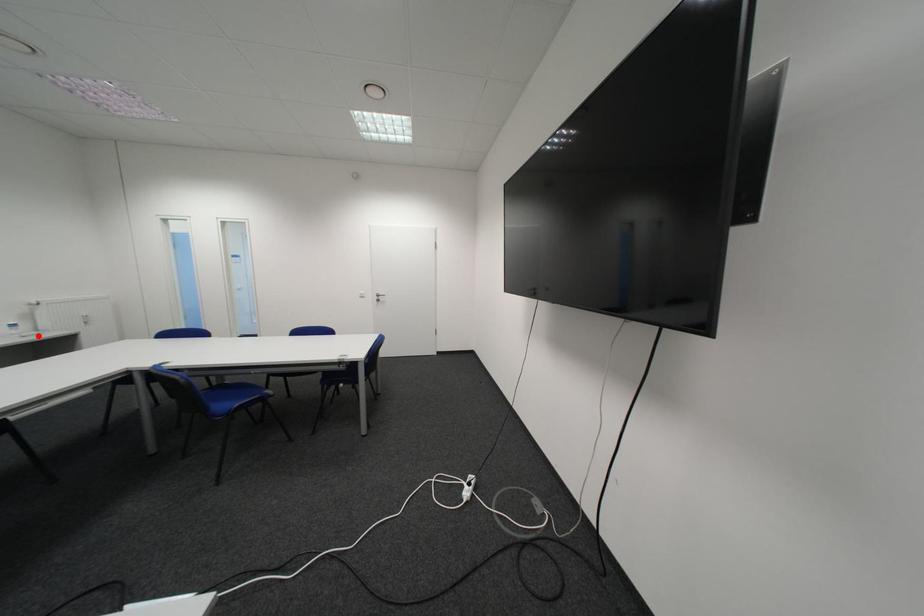
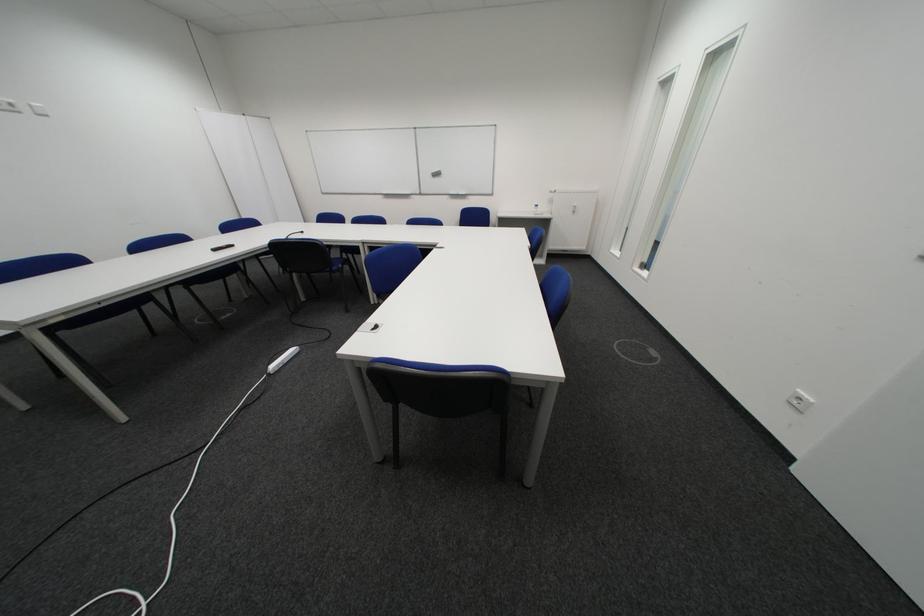
Where in the second image is the point corresponding to the highlighted location from the first image?

(548, 215)